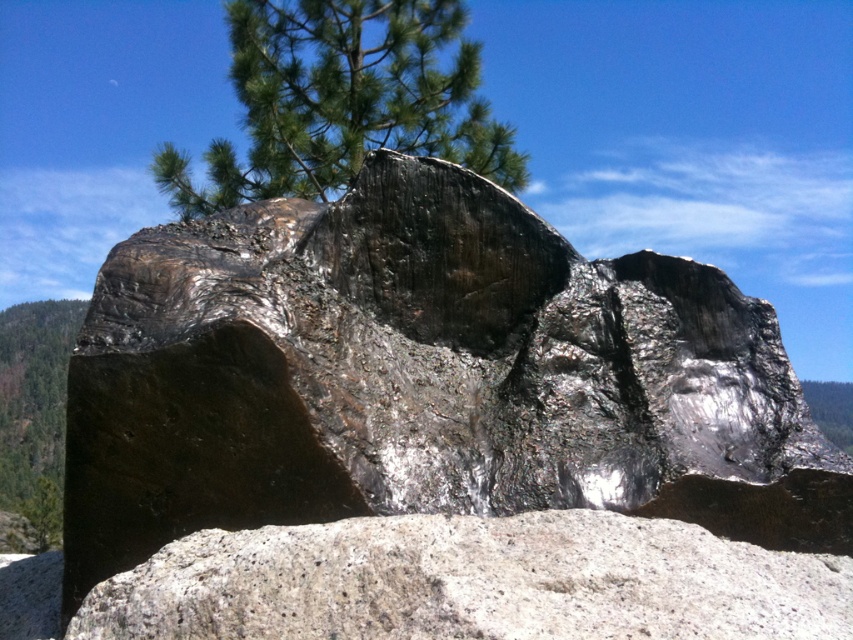
From the picture: You are planning to place a small birdhouse in this scene. The birdhouse requires a tree that is large enough to support it. Which tree, the green textured pine tree at upper center or the green matte tree at lower left, would be the better choice?

The green textured pine tree at upper center is bigger than the green matte tree at lower left, so the green textured pine tree at upper center would be the better choice to support the birdhouse.

You are standing in front of a large rock formation. You notice a specific point marked at coordinates [424,378]. Based on the description, what object does this point most likely correspond to?

The point at coordinates [424,378] corresponds to the shiny metallic rock at center.